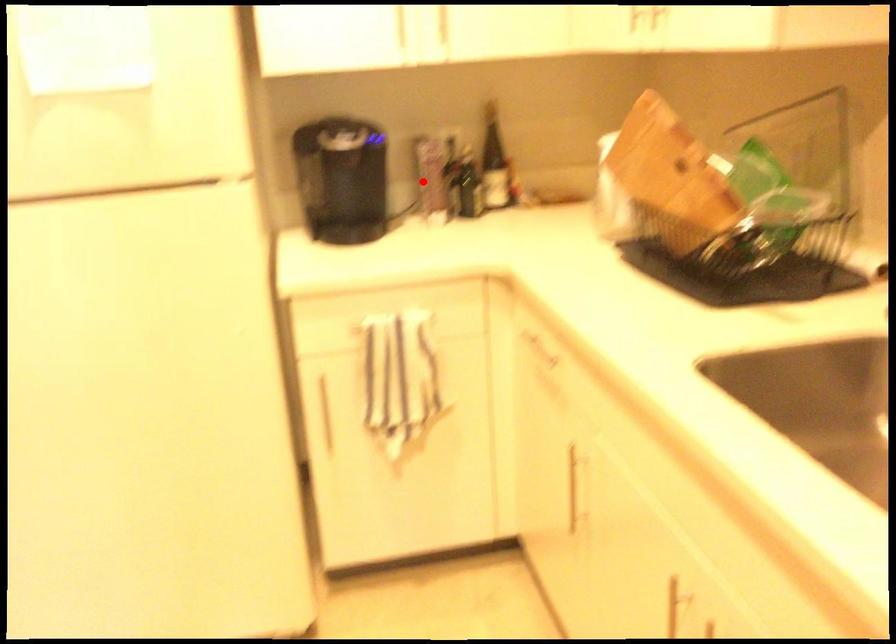
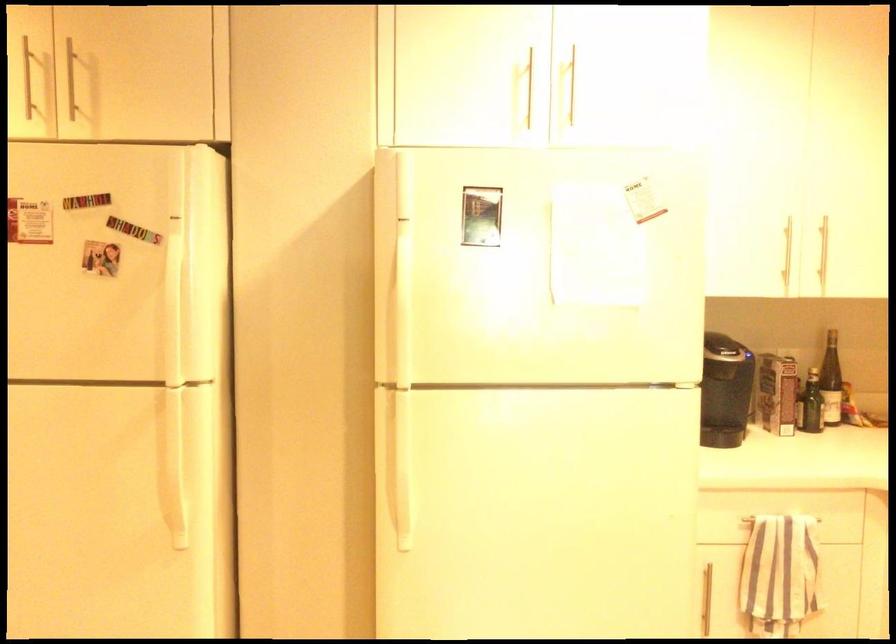
Question: A red point is marked in image1. In image2, is the corresponding 3D point closer to the camera or farther? Reply with the corresponding letter.

Choices:
 (A) The corresponding 3D point is closer.
 (B) The corresponding 3D point is farther.

Answer: (B)